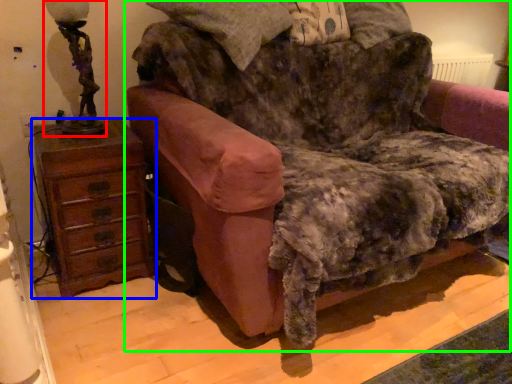
Question: Which is farther away from table lamp (highlighted by a red box)? chest of drawers (highlighted by a blue box) or furniture (highlighted by a green box)?

Choices:
 (A) chest of drawers
 (B) furniture

Answer: (B)